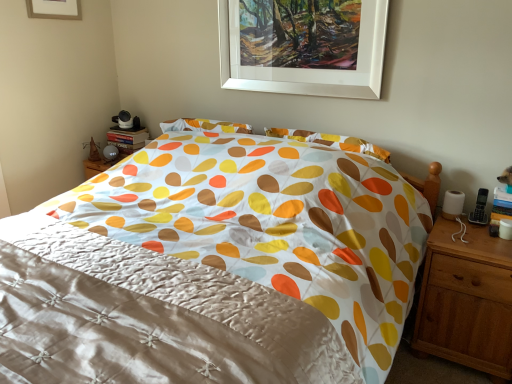
Question: Which direction should I rotate to look at white matte picture frame at upper center, placed as the 1th picture frame when sorted from left to right?

Choices:
 (A) right
 (B) left

Answer: (B)

Question: Considering the relative sizes of white matte picture frame at upper center, which is the second picture frame from top to bottom, and white matte picture frame at upper center, marked as the second picture frame in a bottom-to-top arrangement, in the image provided, is white matte picture frame at upper center, which is the second picture frame from top to bottom, taller than white matte picture frame at upper center, marked as the second picture frame in a bottom-to-top arrangement,?

Choices:
 (A) yes
 (B) no

Answer: (A)

Question: From the image's perspective, is white matte picture frame at upper center, the 1th picture frame viewed from the right, beneath white matte picture frame at upper center, the 2th picture frame viewed from the right?

Choices:
 (A) yes
 (B) no

Answer: (A)

Question: From the image's perspective, is white matte picture frame at upper center, which is the second picture frame from top to bottom, located above white matte picture frame at upper center, marked as the second picture frame in a bottom-to-top arrangement?

Choices:
 (A) yes
 (B) no

Answer: (B)

Question: From a real-world perspective, is white matte picture frame at upper center, marked as the 1th picture frame in a bottom-to-top arrangement, positioned under white matte picture frame at upper center, marked as the second picture frame in a bottom-to-top arrangement, based on gravity?

Choices:
 (A) yes
 (B) no

Answer: (A)

Question: Is white matte picture frame at upper center, marked as the 1th picture frame in a bottom-to-top arrangement, closer to the viewer compared to white matte picture frame at upper center, the 2th picture frame viewed from the right?

Choices:
 (A) yes
 (B) no

Answer: (A)

Question: Is white matte picture frame at upper center, which is the second picture frame from top to bottom, not near white matte picture frame at upper center, placed as the 1th picture frame when sorted from left to right?

Choices:
 (A) yes
 (B) no

Answer: (A)

Question: From a real-world perspective, is light brown wood nightstand at right under white matte picture frame at upper center, marked as the 1th picture frame in a bottom-to-top arrangement?

Choices:
 (A) yes
 (B) no

Answer: (A)

Question: Are light brown wood nightstand at right and white matte picture frame at upper center, the 2th picture frame from the left, beside each other?

Choices:
 (A) yes
 (B) no

Answer: (B)

Question: Is the position of light brown wood nightstand at right less distant than that of white matte picture frame at upper center, the 1th picture frame viewed from the right?

Choices:
 (A) no
 (B) yes

Answer: (B)

Question: Can you confirm if light brown wood nightstand at right is bigger than white matte picture frame at upper center, the 2th picture frame from the left?

Choices:
 (A) no
 (B) yes

Answer: (B)

Question: Does light brown wood nightstand at right appear on the right side of white matte picture frame at upper center, which is the second picture frame from top to bottom?

Choices:
 (A) yes
 (B) no

Answer: (A)

Question: Can you confirm if light brown wood nightstand at right is wider than white matte picture frame at upper center, which is the second picture frame from top to bottom?

Choices:
 (A) yes
 (B) no

Answer: (A)

Question: From the image's perspective, is silky white quilt at center on white matte picture frame at upper center, placed as the 1th picture frame when sorted from left to right?

Choices:
 (A) no
 (B) yes

Answer: (A)